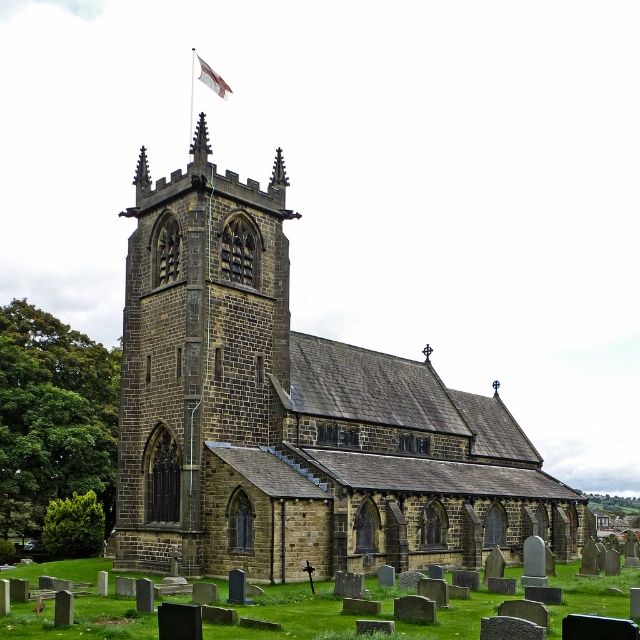
Question: Which point is closer to the camera taking this photo?

Choices:
 (A) (225, 83)
 (B) (204, 362)
 (C) (186, 205)

Answer: (B)

Question: Which point is closer to the camera taking this photo?

Choices:
 (A) (216, 84)
 (B) (204, 244)
 (C) (401, 458)

Answer: (B)

Question: Can you confirm if brown stone church at center is thinner than brown stone tower at center?

Choices:
 (A) yes
 (B) no

Answer: (B)

Question: Where is brown stone church at center located in relation to brown stone tower at center in the image?

Choices:
 (A) below
 (B) above

Answer: (A)

Question: Based on their relative distances, which object is farther from the white fabric flag at upper center?

Choices:
 (A) brown stone church at center
 (B) brown stone tower at center

Answer: (A)

Question: Is brown stone church at center bigger than white fabric flag at upper center?

Choices:
 (A) no
 (B) yes

Answer: (B)